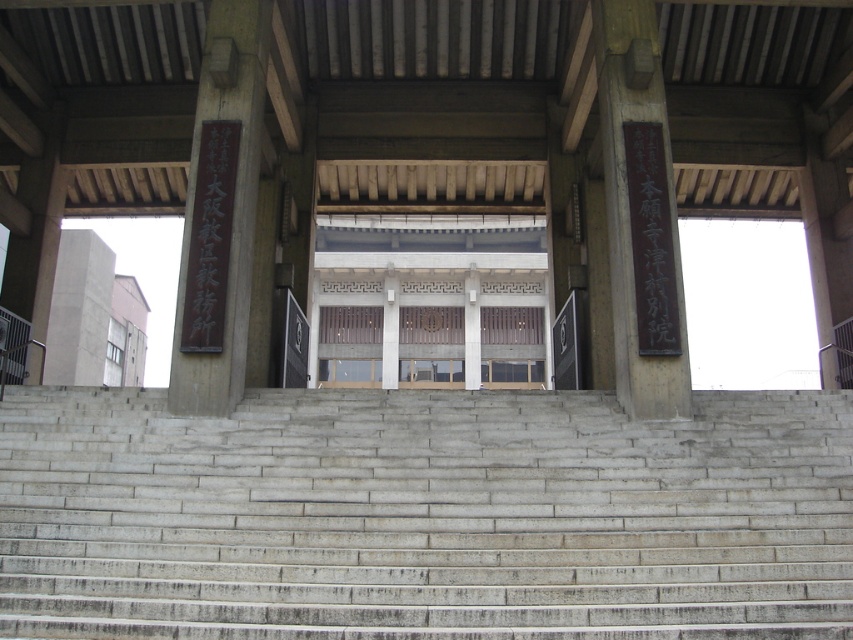
Does black stone sign at right have a greater height compared to black polished wood sign at left?

No.

This screenshot has width=853, height=640. I want to click on black stone sign at right, so tap(640, 212).

Where is `black stone sign at right`? The image size is (853, 640). black stone sign at right is located at coordinates (640, 212).

Does gray concrete stairs at center have a lesser width compared to black polished wood sign at left?

Incorrect, gray concrete stairs at center's width is not less than black polished wood sign at left's.

Describe the element at coordinates (424, 515) in the screenshot. I see `gray concrete stairs at center` at that location.

At what (x,y) coordinates should I click in order to perform the action: click on gray concrete stairs at center. Please return your answer as a coordinate pair (x, y). Image resolution: width=853 pixels, height=640 pixels. Looking at the image, I should click on (424, 515).

Does gray concrete stairs at center have a greater width compared to black stone sign at right?

Indeed, gray concrete stairs at center has a greater width compared to black stone sign at right.

Who is more forward, (747, 488) or (648, 241)?

Positioned in front is point (747, 488).

The image size is (853, 640). Identify the location of gray concrete stairs at center. (424, 515).